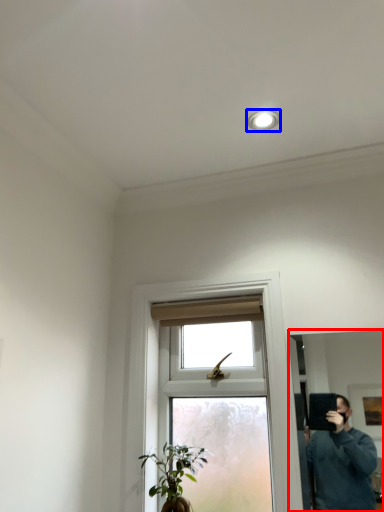
Question: Which object is further to the camera taking this photo, mirror (highlighted by a red box) or light fixture (highlighted by a blue box)?

Choices:
 (A) mirror
 (B) light fixture

Answer: (B)